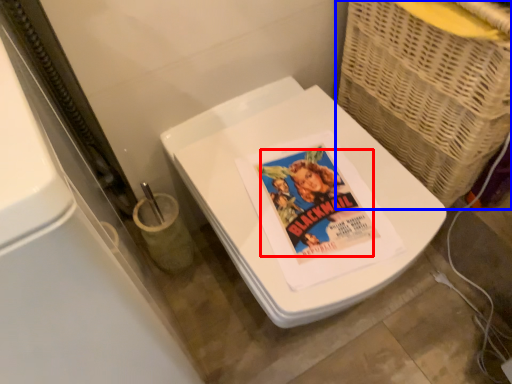
Question: Which object appears farthest to the camera in this image, comic book character (highlighted by a red box) or basket (highlighted by a blue box)?

Choices:
 (A) comic book character
 (B) basket

Answer: (A)